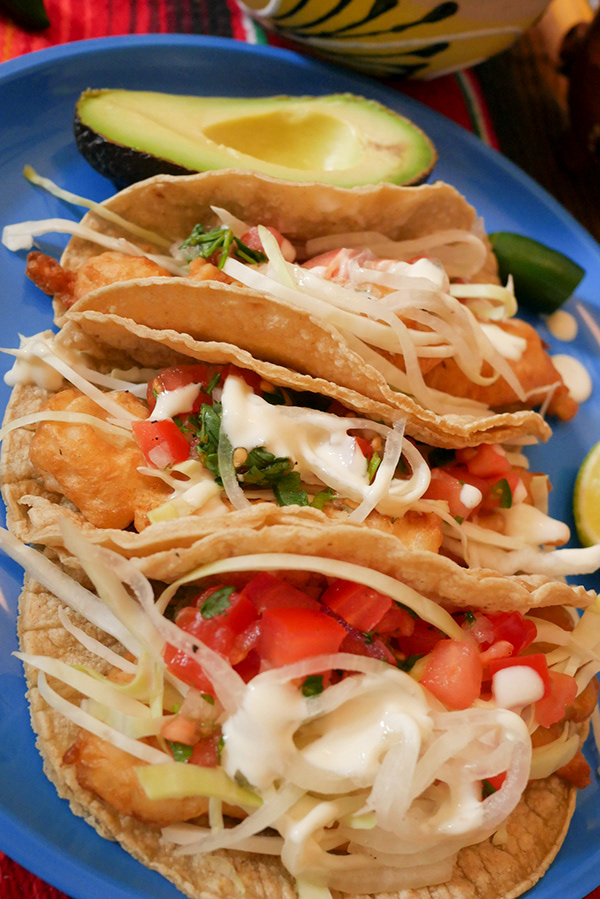
Image resolution: width=600 pixels, height=899 pixels. I want to click on blue bowl, so click(4, 613), click(4, 736), click(98, 859), click(34, 797), click(583, 844), click(572, 455), click(530, 205), click(459, 143), click(198, 54), click(35, 105).